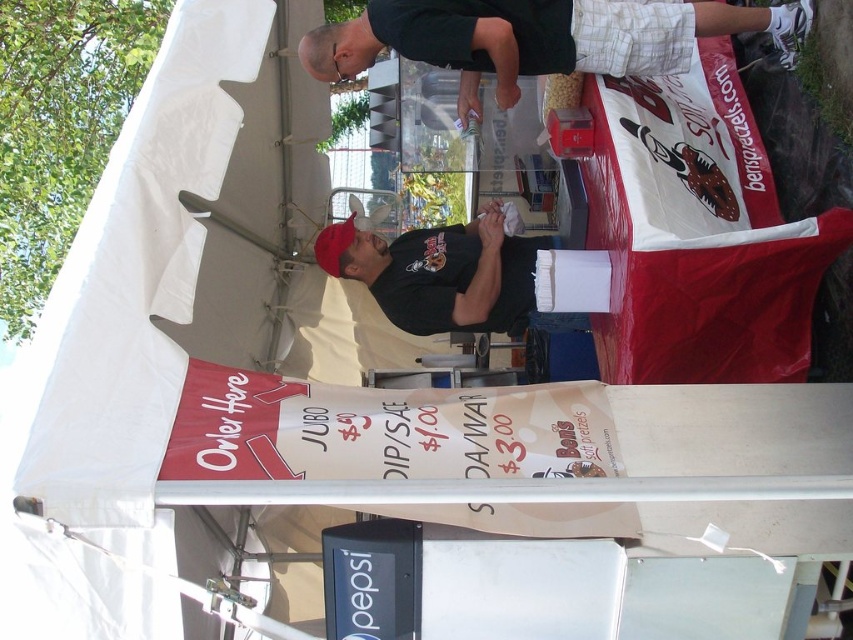
Can you confirm if black shirt at upper center is taller than black matte shirt at center?

No, black shirt at upper center is not taller than black matte shirt at center.

Measure the distance between black shirt at upper center and camera.

black shirt at upper center and camera are 4.38 meters apart from each other.

Identify the location of black shirt at upper center. (540, 38).